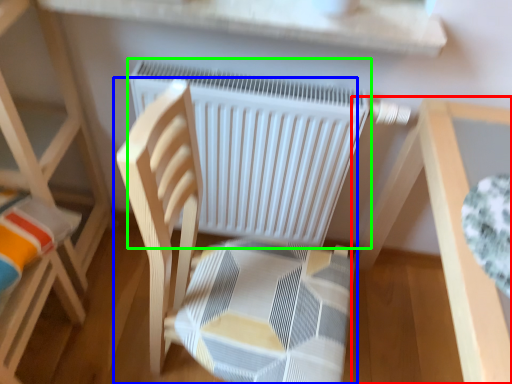
Question: Which is nearer to the table (highlighted by a red box)? chair (highlighted by a blue box) or radiator (highlighted by a green box).

Choices:
 (A) chair
 (B) radiator

Answer: (B)